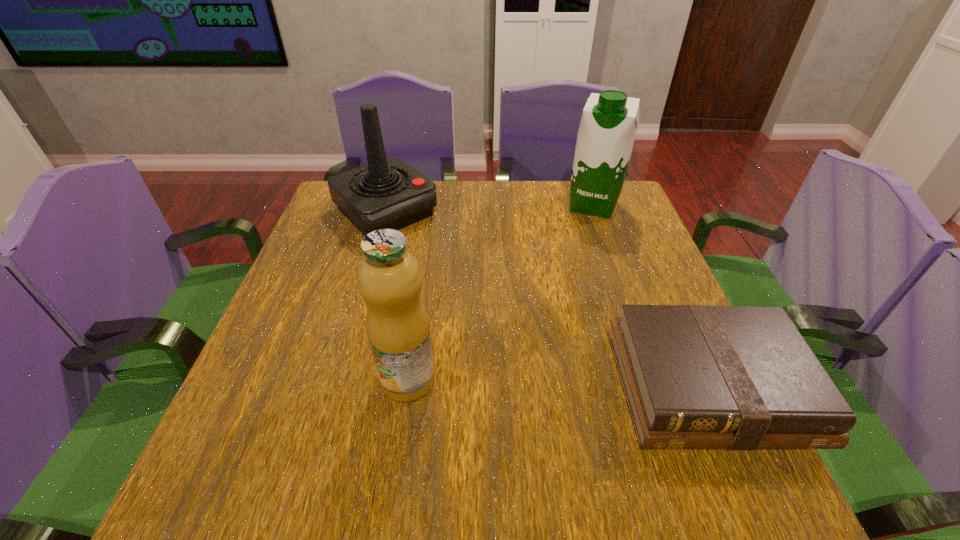
Where is `free space between the Bible and the soya milk`? free space between the Bible and the soya milk is located at coordinates (651, 295).

Locate an element on the screen. The image size is (960, 540). the closest object to the soya milk is located at coordinates (387, 193).

Locate which object is the closest to the joystick. Please provide its 2D coordinates. Your answer should be formatted as a tuple, i.e. [(x, y)], where the tuple contains the x and y coordinates of a point satisfying the conditions above.

[(389, 279)]